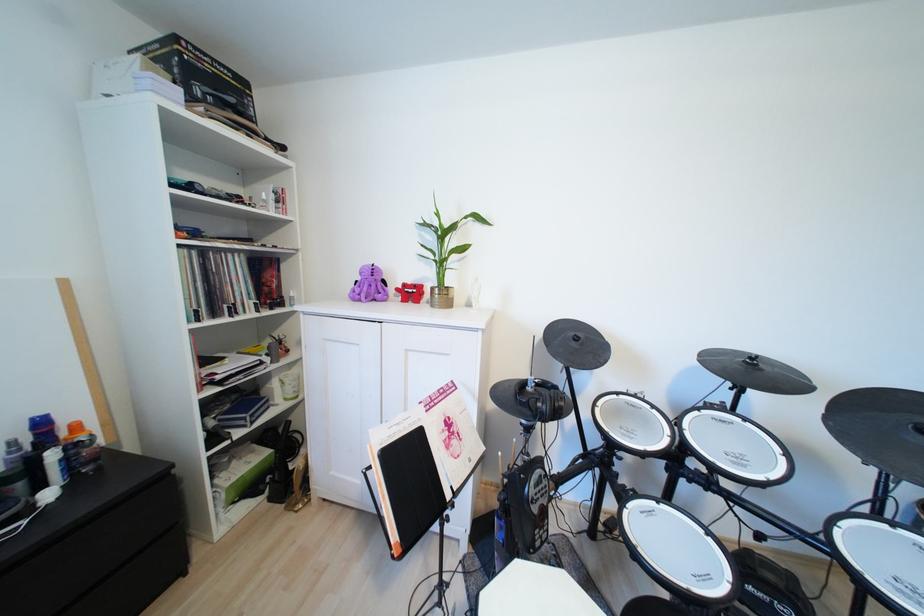
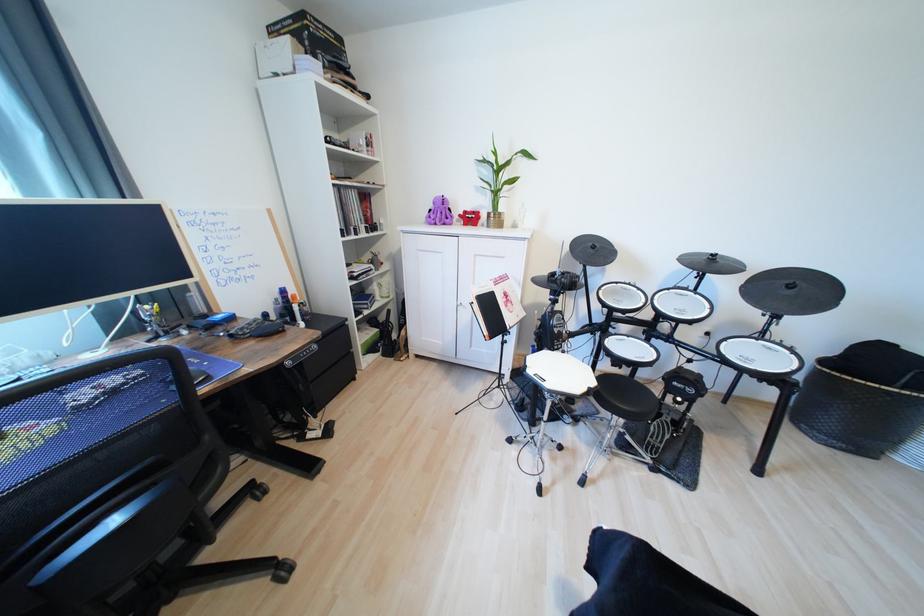
In the second image, find the point that corresponds to point (580, 346) in the first image.

(599, 252)